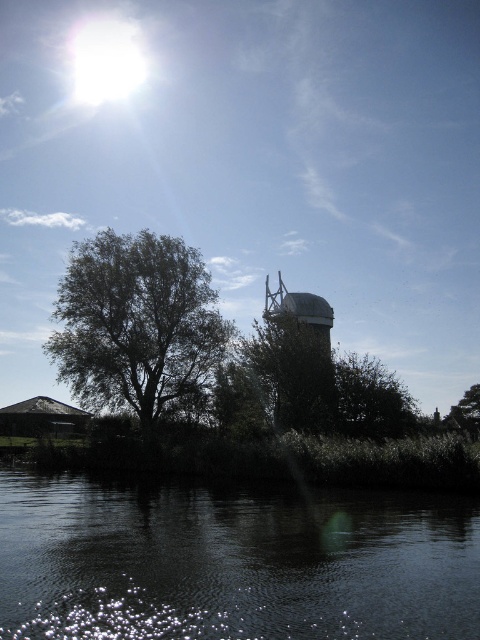
Question: Among these objects, which one is farthest from the camera?

Choices:
 (A) dark reflective water at lower center
 (B) green leafy tree at left
 (C) green leafy tree at center

Answer: (B)

Question: Where is dark reflective water at lower center located in relation to green leafy tree at lower right in the image?

Choices:
 (A) right
 (B) left

Answer: (B)

Question: Which object is closer to the camera taking this photo?

Choices:
 (A) green leafy tree at lower right
 (B) dark reflective water at lower center

Answer: (B)

Question: From the image, what is the correct spatial relationship of dark reflective water at lower center in relation to green leafy tree at left?

Choices:
 (A) below
 (B) above

Answer: (A)

Question: Which point appears closest to the camera in this image?

Choices:
 (A) (107, 264)
 (B) (456, 413)
 (C) (346, 429)

Answer: (C)

Question: Does green leafy tree at center appear under green leafy tree at lower right?

Choices:
 (A) yes
 (B) no

Answer: (B)